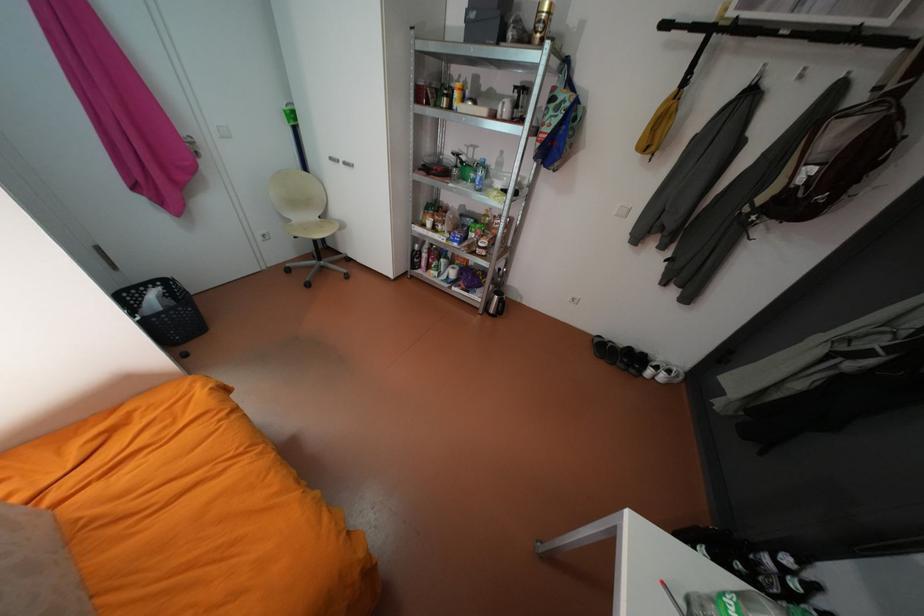
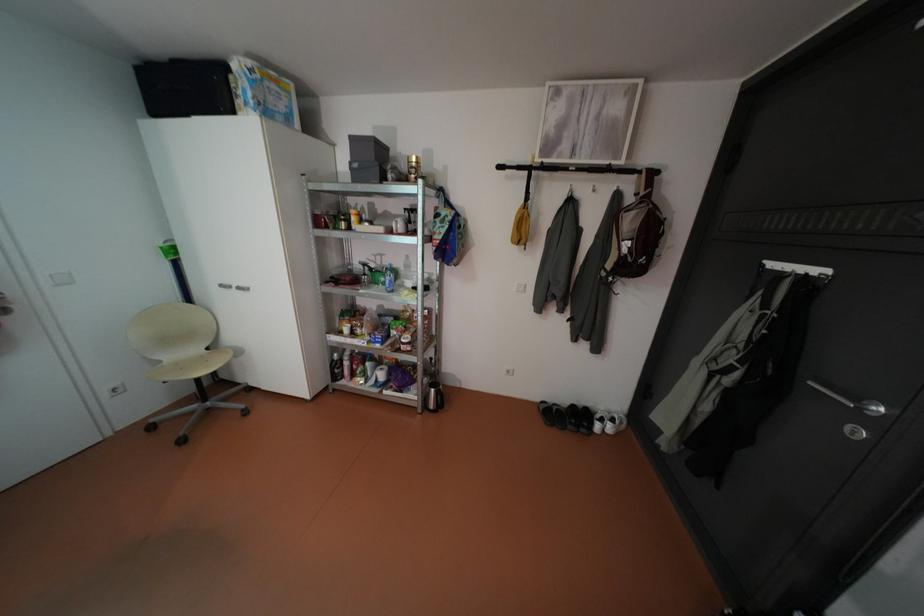
How did the camera likely rotate?

The camera's rotation is toward right-up.